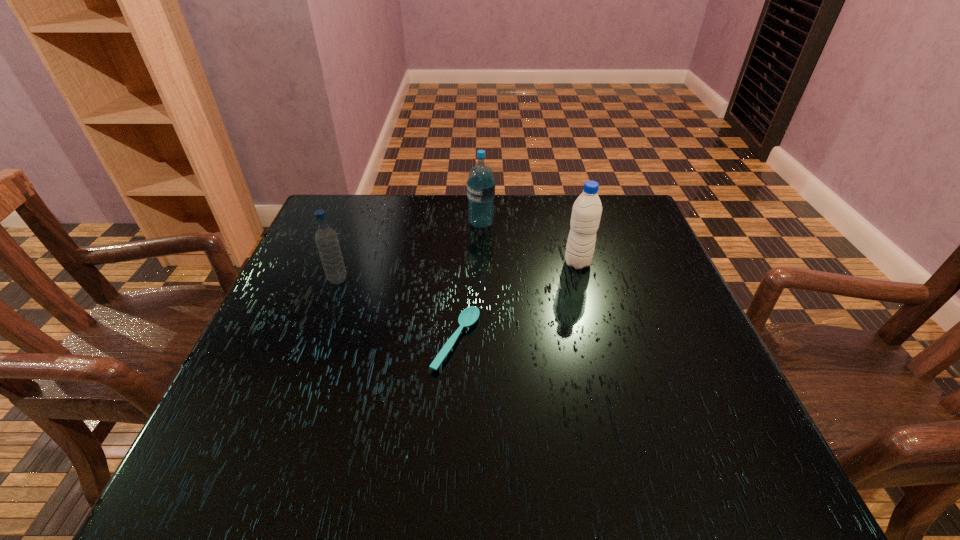
The image size is (960, 540). What are the coordinates of `vacant space that's between the spoon and the second farthest object` in the screenshot? It's located at (516, 302).

I want to click on free space between the shortest object and the rightmost object, so click(x=516, y=302).

You are a GUI agent. You are given a task and a screenshot of the screen. Output one action in this format:
    pyautogui.click(x=<x>, y=<y>)
    Task: Click on the empty space between the leftmost water bottle and the shortest object
    The width and height of the screenshot is (960, 540).
    Given the screenshot: What is the action you would take?
    pyautogui.click(x=397, y=310)

Find the location of `vacant area between the shortest object and the second farthest water bottle`. vacant area between the shortest object and the second farthest water bottle is located at coordinates (516, 302).

You are a GUI agent. You are given a task and a screenshot of the screen. Output one action in this format:
    pyautogui.click(x=<x>, y=<y>)
    Task: Click on the empty location between the shortest object and the second nearest water bottle
    
    Given the screenshot: What is the action you would take?
    coord(516,302)

I want to click on free area in between the second water bottle from right to left and the second farthest object, so click(x=529, y=244).

Locate an element on the screen. This screenshot has width=960, height=540. unoccupied position between the nearest water bottle and the farthest water bottle is located at coordinates (409, 252).

The image size is (960, 540). I want to click on free spot between the third farthest object and the rightmost object, so click(x=458, y=272).

Identify the location of free space between the second water bottle from right to left and the third nearest object. This screenshot has width=960, height=540. (529, 244).

Find the location of a particular element. The width and height of the screenshot is (960, 540). empty space between the shortest object and the farthest water bottle is located at coordinates (468, 282).